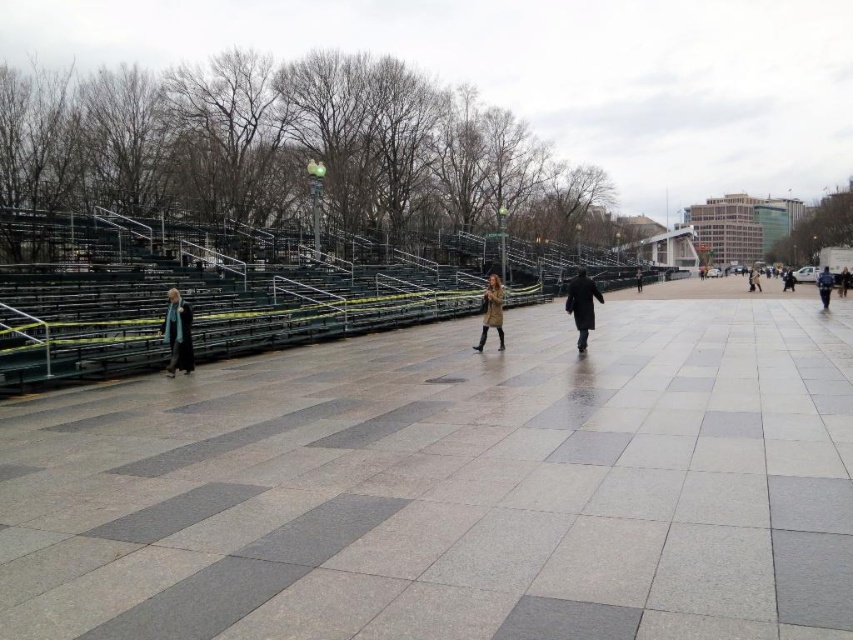
Question: Is dark brown leather jacket at center further to camera compared to dark blue coat at center?

Choices:
 (A) yes
 (B) no

Answer: (A)

Question: Is dark matte coat at center smaller than dark brown leather coat at center?

Choices:
 (A) no
 (B) yes

Answer: (A)

Question: Is dark blue coat at right to the right of dark blue coat at center from the viewer's perspective?

Choices:
 (A) no
 (B) yes

Answer: (A)

Question: Among these objects, which one is farthest from the camera?

Choices:
 (A) dark blue coat at center
 (B) dark gray wool coat at left
 (C) dark blue coat at right
 (D) dark brown leather jacket at right

Answer: (A)

Question: Which object appears closest to the camera in this image?

Choices:
 (A) dark brown leather coat at center
 (B) dark matte coat at center

Answer: (B)

Question: Based on their relative distances, which object is nearer to the dark blue coat at right?

Choices:
 (A) dark blue coat at center
 (B) dark matte coat at center

Answer: (A)